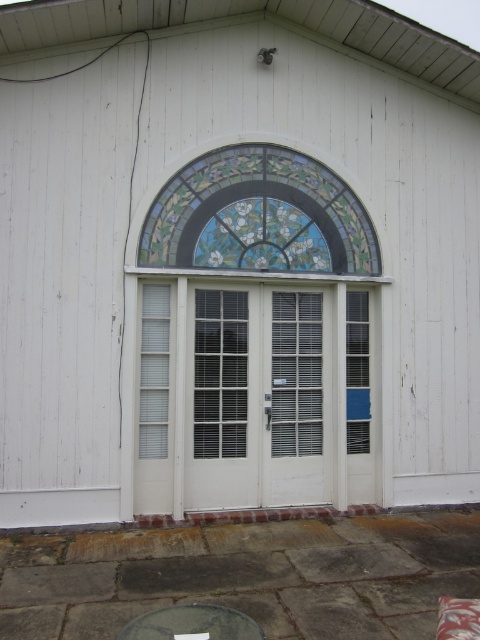
Question: Where is white textured glass door at center located in relation to stained glass at center in the image?

Choices:
 (A) below
 (B) above

Answer: (A)

Question: Which point is closer to the camera taking this photo?

Choices:
 (A) coord(467,604)
 (B) coord(191,605)

Answer: (A)

Question: Which point is farther from the camera taking this photo?

Choices:
 (A) (189, 257)
 (B) (439, 625)

Answer: (A)

Question: Can you confirm if white textured glass door at center is wider than stained glass at center?

Choices:
 (A) no
 (B) yes

Answer: (A)

Question: Which point is farther to the camera?

Choices:
 (A) fluffy pink pillow at lower right
 (B) smooth gray table at lower center

Answer: (B)

Question: Is white textured glass door at center above stained glass at center?

Choices:
 (A) yes
 (B) no

Answer: (B)